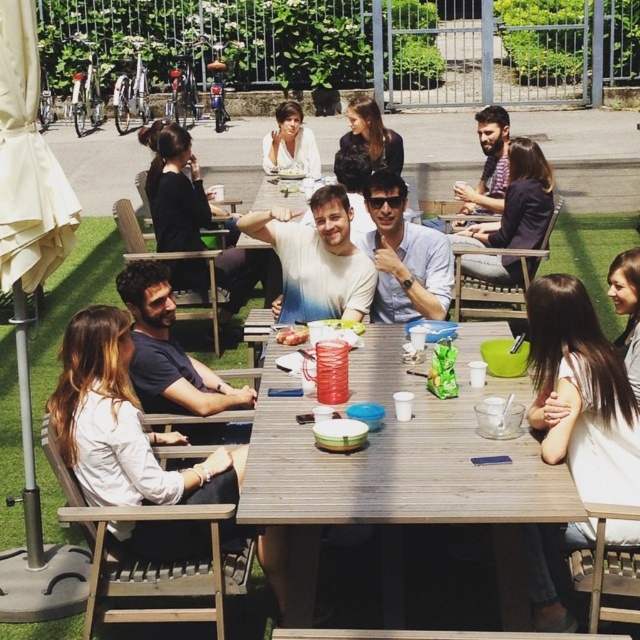
What do you see at coordinates (168, 352) in the screenshot? The height and width of the screenshot is (640, 640). I see `dark blue t-shirt at left` at bounding box center [168, 352].

I want to click on dark blue t-shirt at left, so click(x=168, y=352).

Is white matte shirt at center positioned before dark brown hair at center?

That is False.

Who is more forward, [284,140] or [358,116]?

Positioned in front is point [358,116].

Image resolution: width=640 pixels, height=640 pixels. I want to click on white matte shirt at center, so coord(291,144).

Is white cotton t-shirt at center to the left of matte blue shirt at center from the viewer's perspective?

Indeed, white cotton t-shirt at center is positioned on the left side of matte blue shirt at center.

Identify the location of white cotton t-shirt at center. point(316,259).

The width and height of the screenshot is (640, 640). What do you see at coordinates (316, 259) in the screenshot? I see `white cotton t-shirt at center` at bounding box center [316, 259].

Identify the location of white cotton t-shirt at center. (316, 259).